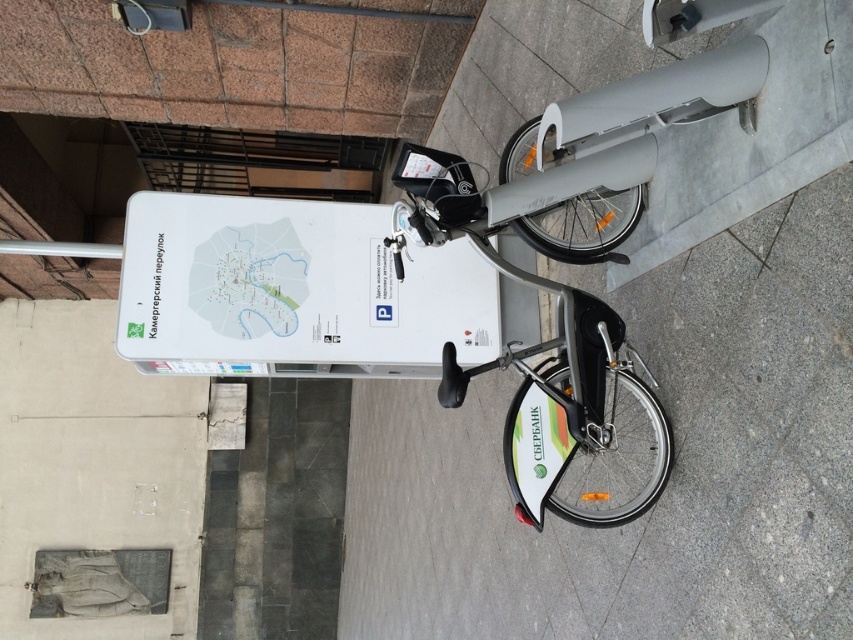
You are a delivery person who needs to attach a GPS tracker to the metallic silver bicycle at center. The tracker must be placed within 70 centimeters of the white matte sign at upper center to ensure signal strength. Can you attach it in a position that meets this requirement?

The white matte sign at upper center and metallic silver bicycle at center are 72.51 centimeters apart. Since the required distance is 70 centimeters, the tracker cannot be placed within the required range as the distance exceeds it.

You are a tourist in Moscow and see the metallic silver bicycle at center and the white matte sign at upper center. Which object is closer to you?

The white matte sign at upper center is closer to you because the metallic silver bicycle at center is behind it.

You are a tourist in Moscow and see the white matte sign at upper center and the metallic silver bicycle at center. According to the image, which object is positioned higher relative to the other?

The white matte sign at upper center is above the metallic silver bicycle at center, so it is positioned higher.